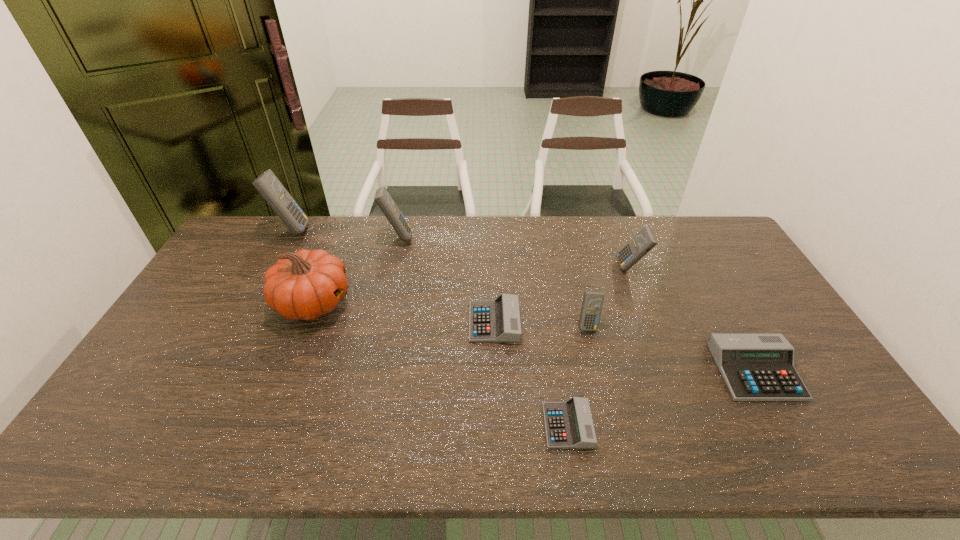
The width and height of the screenshot is (960, 540). Identify the location of the tallest object. (267, 184).

At what (x,y) coordinates should I click in order to perform the action: click on the leftmost blue calculator. Please return your answer as a coordinate pair (x, y). Looking at the image, I should click on (267, 184).

Locate an element on the screen. The image size is (960, 540). the second biggest blue calculator is located at coordinates (382, 197).

You are a GUI agent. You are given a task and a screenshot of the screen. Output one action in this format:
    pyautogui.click(x=<x>, y=<y>)
    Task: Click on the sixth shortest calculator
    The width and height of the screenshot is (960, 540).
    Given the screenshot: What is the action you would take?
    pyautogui.click(x=382, y=197)

I want to click on pumpkin, so click(305, 285).

The height and width of the screenshot is (540, 960). What are the coordinates of `the second object from left to right` in the screenshot? It's located at (305, 285).

The image size is (960, 540). Identify the location of the third biggest blue calculator. (638, 246).

The width and height of the screenshot is (960, 540). What are the coordinates of `the sixth calculator from left to right` in the screenshot? It's located at (638, 246).

Locate an element on the screen. the nearest blue calculator is located at coordinates (592, 304).

The width and height of the screenshot is (960, 540). I want to click on the smallest blue calculator, so click(x=592, y=304).